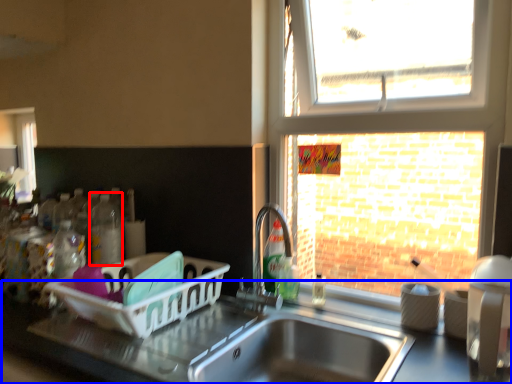
Question: Which of the following is the closest to the observer, bottle (highlighted by a red box) or counter top (highlighted by a blue box)?

Choices:
 (A) bottle
 (B) counter top

Answer: (B)